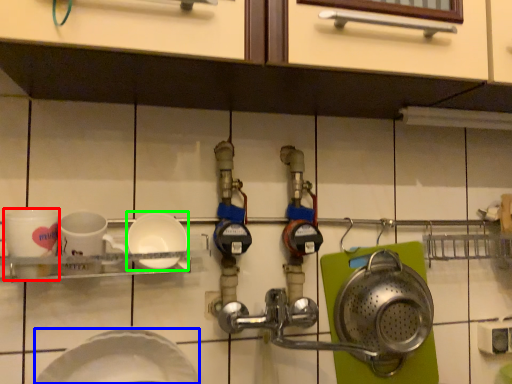
Question: Based on their relative distances, which object is nearer to coffee cup (highlighted by a red box)? Choose from plate (highlighted by a blue box) and plate (highlighted by a green box).

Choices:
 (A) plate
 (B) plate

Answer: (B)